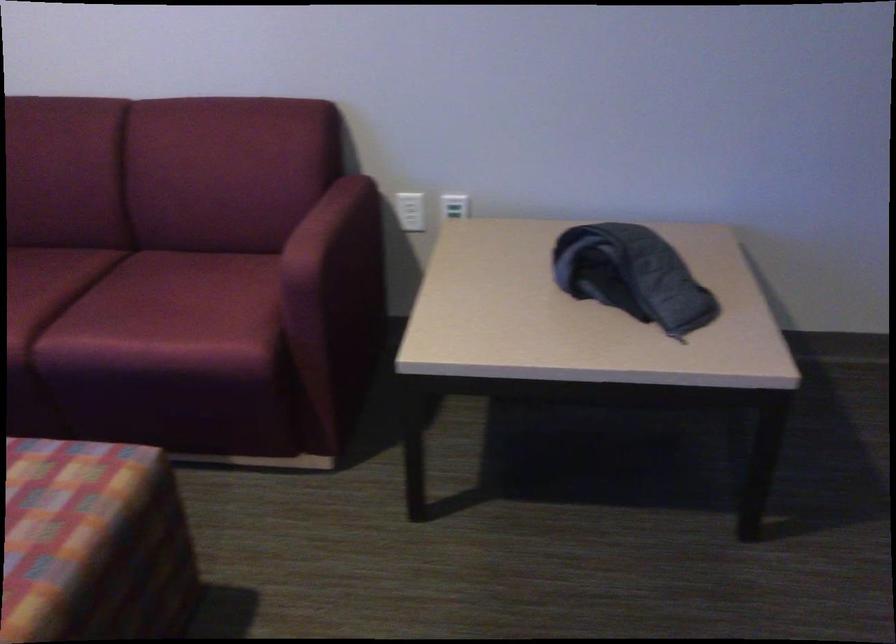
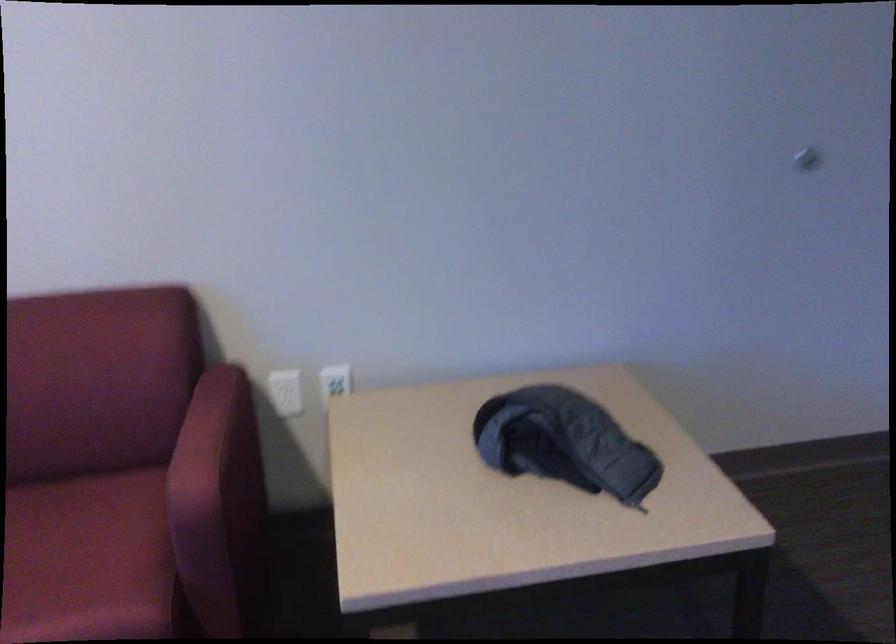
Find the pixel in the second image that matches pixel 451 205 in the first image.

(334, 382)